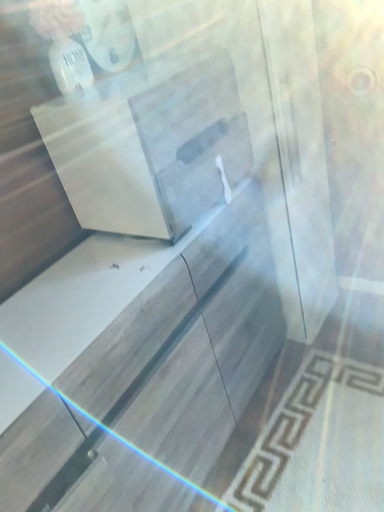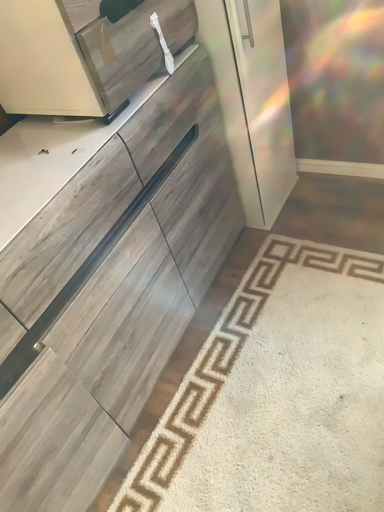
Question: How did the camera likely rotate when shooting the video?

Choices:
 (A) rotated upward
 (B) rotated downward

Answer: (B)